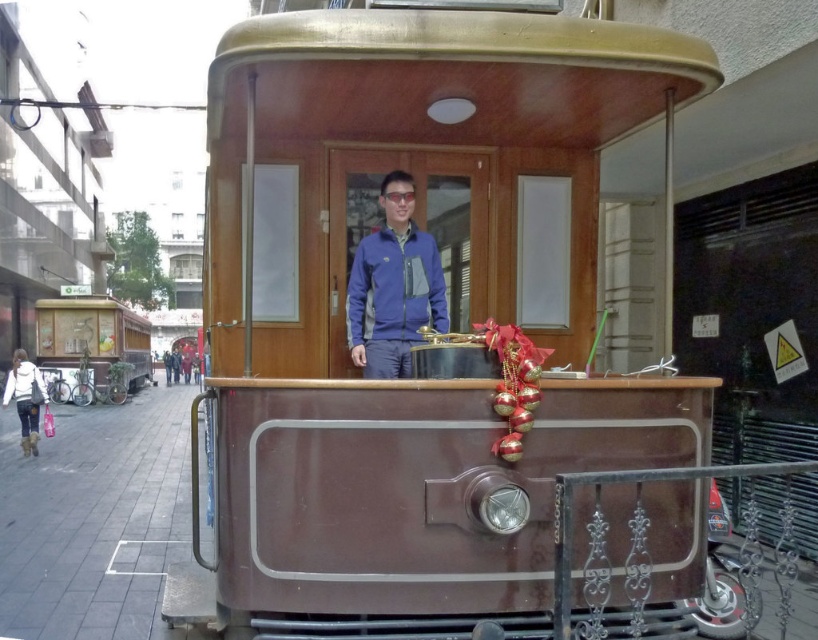
Question: Is blue fleece jacket at center to the left of wooden cart at left from the viewer's perspective?

Choices:
 (A) yes
 (B) no

Answer: (B)

Question: Which of the following is the closest to the observer?

Choices:
 (A) (106, 372)
 (B) (409, 428)
 (C) (354, 252)

Answer: (B)

Question: Which point is farther to the camera?

Choices:
 (A) wooden cart at left
 (B) blue fleece jacket at center

Answer: (A)

Question: Can you confirm if brown polished wood train at center is bigger than wooden cart at left?

Choices:
 (A) yes
 (B) no

Answer: (B)

Question: Does brown polished wood train at center have a lesser width compared to blue fleece jacket at center?

Choices:
 (A) no
 (B) yes

Answer: (A)

Question: Which of the following is the farthest from the observer?

Choices:
 (A) blue fleece jacket at center
 (B) wooden cart at left

Answer: (B)